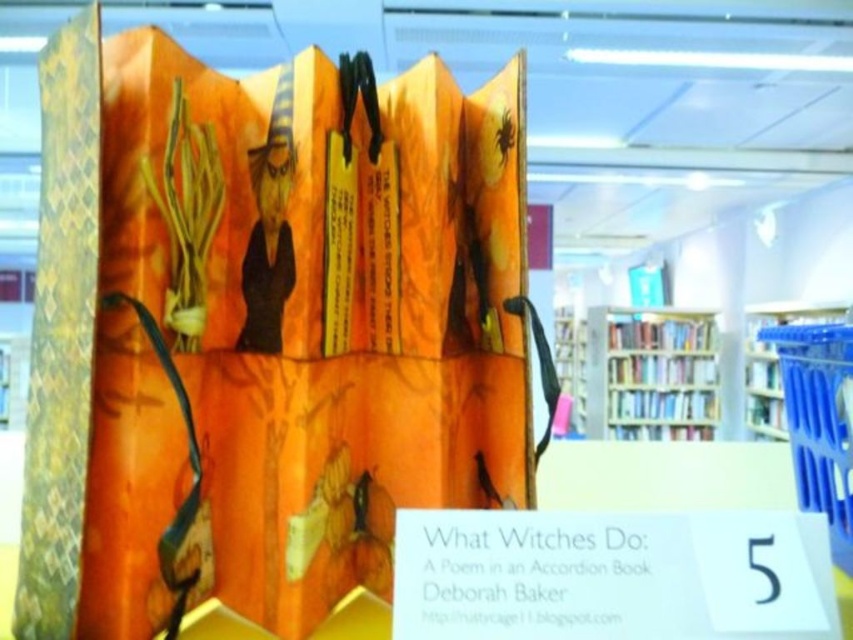
Question: Is wooden bookshelf at center above blue plastic bookshelf at right?

Choices:
 (A) yes
 (B) no

Answer: (B)

Question: Is yellow woven fabric at left thinner than wooden bookshelf at center?

Choices:
 (A) no
 (B) yes

Answer: (B)

Question: Is yellow woven fabric at left behind blue plastic bookshelf at right?

Choices:
 (A) no
 (B) yes

Answer: (A)

Question: Estimate the real-world distances between objects in this image. Which object is farther from the wooden bookshelf at center?

Choices:
 (A) yellow woven fabric at left
 (B) blue plastic bookshelf at right

Answer: (A)

Question: Among these objects, which one is farthest from the camera?

Choices:
 (A) blue plastic bookshelf at right
 (B) yellow woven fabric at left
 (C) wooden bookshelf at center

Answer: (C)

Question: Which of these objects is positioned closest to the wooden bookshelf at center?

Choices:
 (A) blue plastic bookshelf at right
 (B) yellow woven fabric at left

Answer: (A)